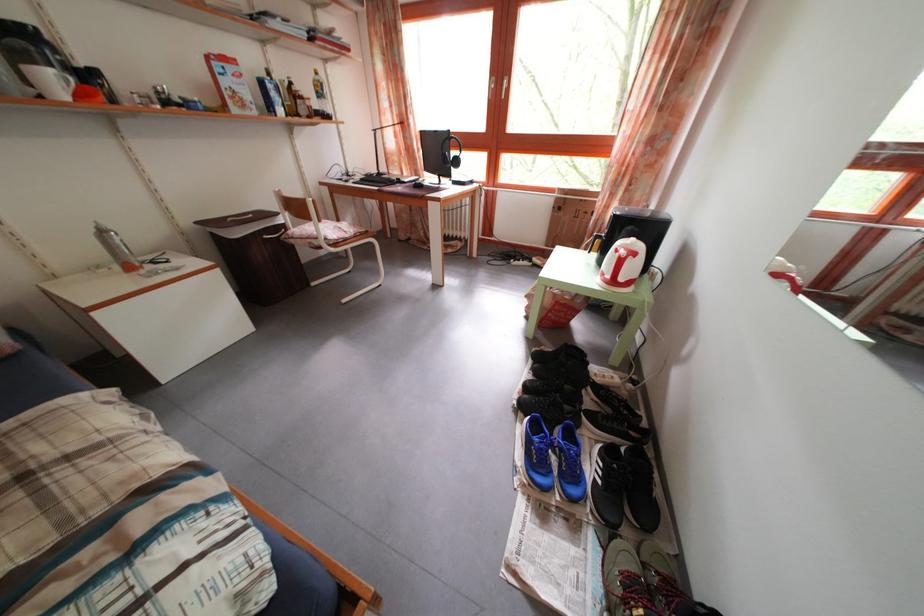
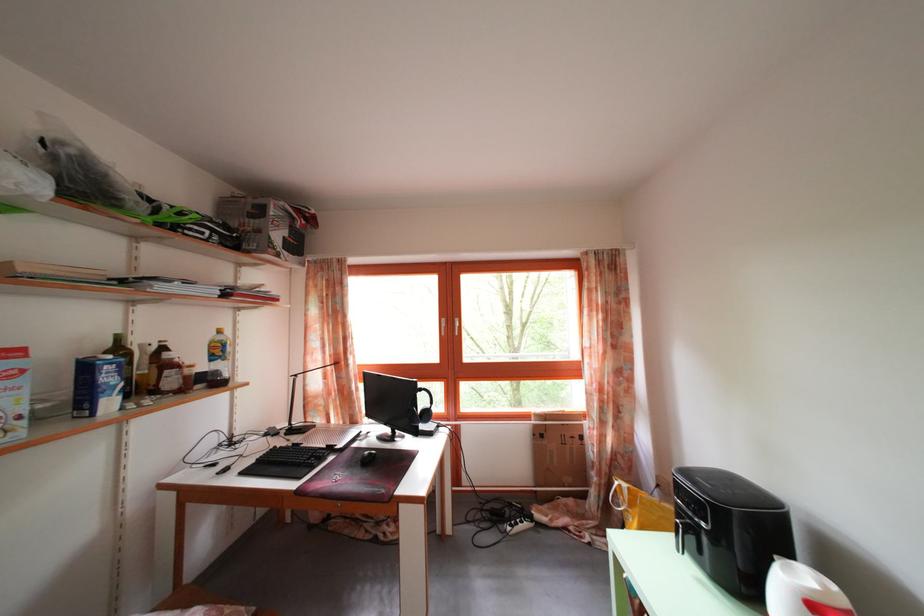
Locate, in the second image, the point that corresponds to (387,190) in the first image.

(307, 472)